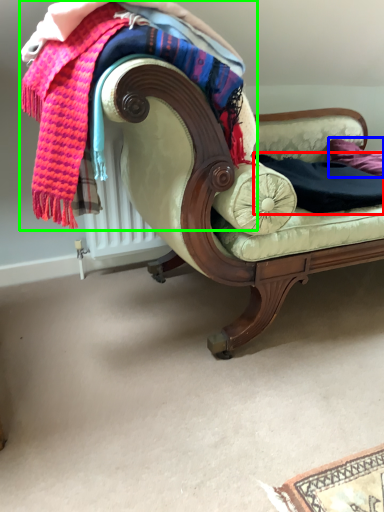
Question: Which is nearer to the clothing (highlighted by a red box)? pillow (highlighted by a blue box) or laundry (highlighted by a green box).

Choices:
 (A) pillow
 (B) laundry

Answer: (A)